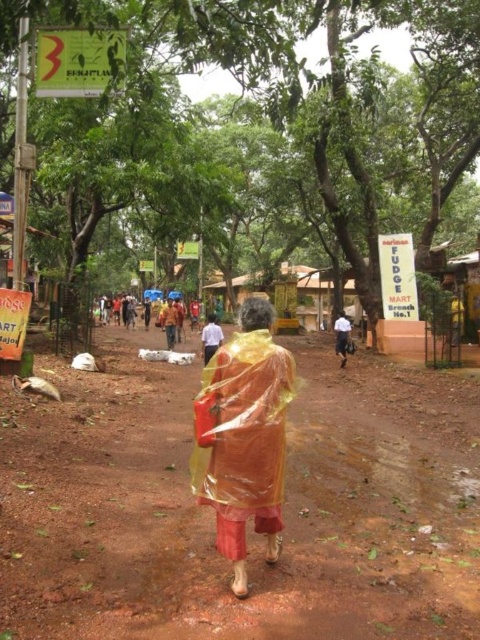
Question: Is brown dirt field at center below yellow translucent raincoat at center?

Choices:
 (A) yes
 (B) no

Answer: (A)

Question: Does transparent yellow raincoat at center appear over yellow translucent raincoat at center?

Choices:
 (A) no
 (B) yes

Answer: (A)

Question: Which point is farther to the camera?

Choices:
 (A) brown dirt field at center
 (B) yellow translucent raincoat at center

Answer: (B)

Question: Which point is closer to the camera taking this photo?

Choices:
 (A) (105, 499)
 (B) (239, 474)
 (C) (342, 332)

Answer: (B)

Question: Is brown dirt field at center positioned before transparent yellow raincoat at center?

Choices:
 (A) no
 (B) yes

Answer: (B)

Question: Which object is closer to the camera taking this photo?

Choices:
 (A) yellow translucent raincoat at center
 (B) brown dirt field at center

Answer: (B)